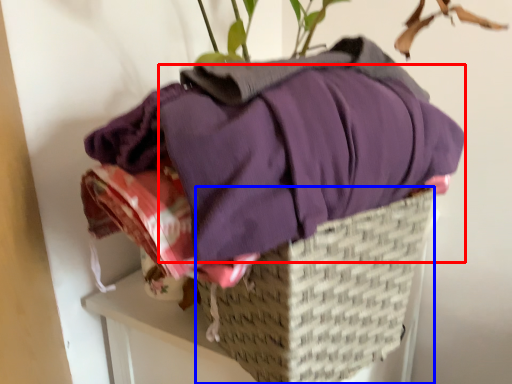
Question: Which of the following is the farthest to the observer, clothing (highlighted by a red box) or basket (highlighted by a blue box)?

Choices:
 (A) clothing
 (B) basket

Answer: (B)